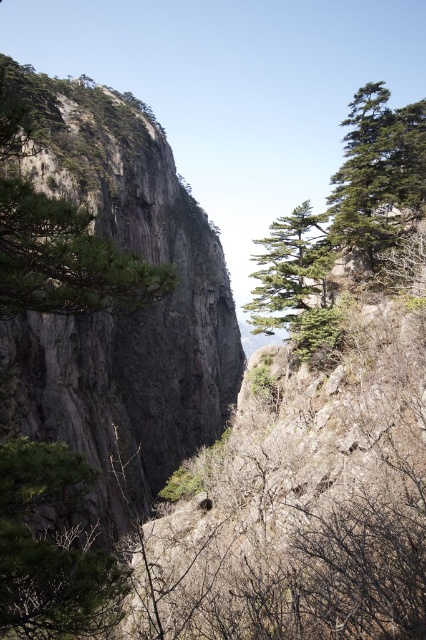
Question: Does green matte tree at lower left lie in front of green matte tree at upper right?

Choices:
 (A) yes
 (B) no

Answer: (A)

Question: Among these points, which one is farthest from the camera?

Choices:
 (A) (291, 275)
 (B) (160, 285)
 (C) (334, 224)

Answer: (A)

Question: Can you confirm if green rough rock at upper left is bigger than green matte tree at center?

Choices:
 (A) no
 (B) yes

Answer: (B)

Question: Which object is positioned farthest from the green matte tree at lower left?

Choices:
 (A) green matte tree at upper right
 (B) green rough rock at upper left

Answer: (A)

Question: Does green matte tree at lower left appear on the right side of green matte tree at center?

Choices:
 (A) no
 (B) yes

Answer: (A)

Question: Which object is closer to the camera taking this photo?

Choices:
 (A) green rough rock at upper left
 (B) green matte tree at center
 (C) green matte tree at upper right

Answer: (A)